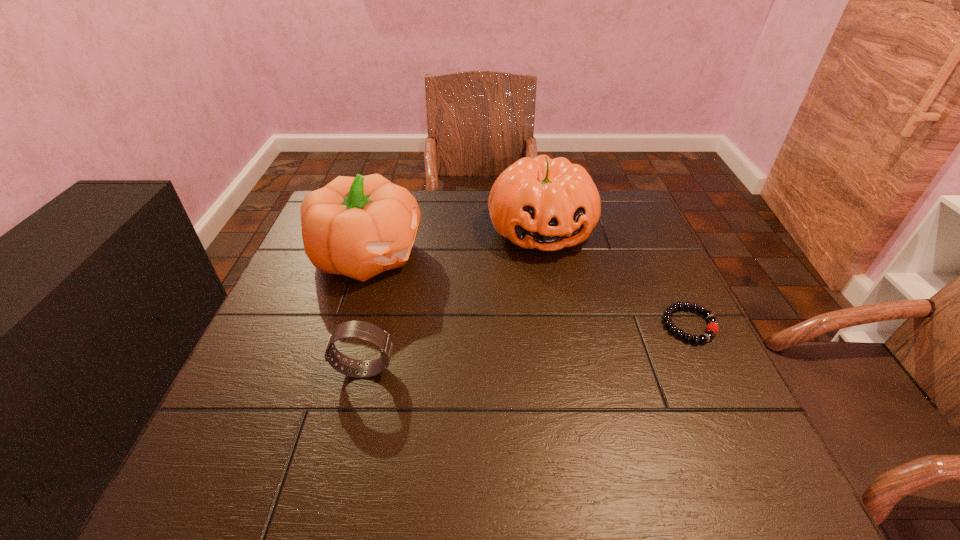
Where is `free space between the left pumpkin and the watch`? free space between the left pumpkin and the watch is located at coordinates (365, 312).

What are the coordinates of `free space between the right pumpkin and the third farthest object` in the screenshot? It's located at (615, 278).

Image resolution: width=960 pixels, height=540 pixels. In order to click on vacant region between the nearest object and the second object from right to left in this screenshot , I will do `click(453, 300)`.

You are a GUI agent. You are given a task and a screenshot of the screen. Output one action in this format:
    pyautogui.click(x=<x>, y=<y>)
    Task: Click on the vacant area between the left pumpkin and the watch
    This screenshot has height=540, width=960.
    Given the screenshot: What is the action you would take?
    pyautogui.click(x=365, y=312)

This screenshot has height=540, width=960. Find the location of `the closest object relative to the second shortest object`. the closest object relative to the second shortest object is located at coordinates (358, 227).

Select which object is the third closest to the shortest object. Please provide its 2D coordinates. Your answer should be formatted as a tuple, i.e. [(x, y)], where the tuple contains the x and y coordinates of a point satisfying the conditions above.

[(366, 331)]

Locate an element on the screen. Image resolution: width=960 pixels, height=540 pixels. vacant point that satisfies the following two spatial constraints: 1. on the front side of the third farthest object; 2. on the left side of the left pumpkin is located at coordinates (343, 325).

This screenshot has width=960, height=540. In order to click on free location that satisfies the following two spatial constraints: 1. on the front side of the left pumpkin; 2. on the right side of the bracelet in this screenshot , I will do `click(343, 325)`.